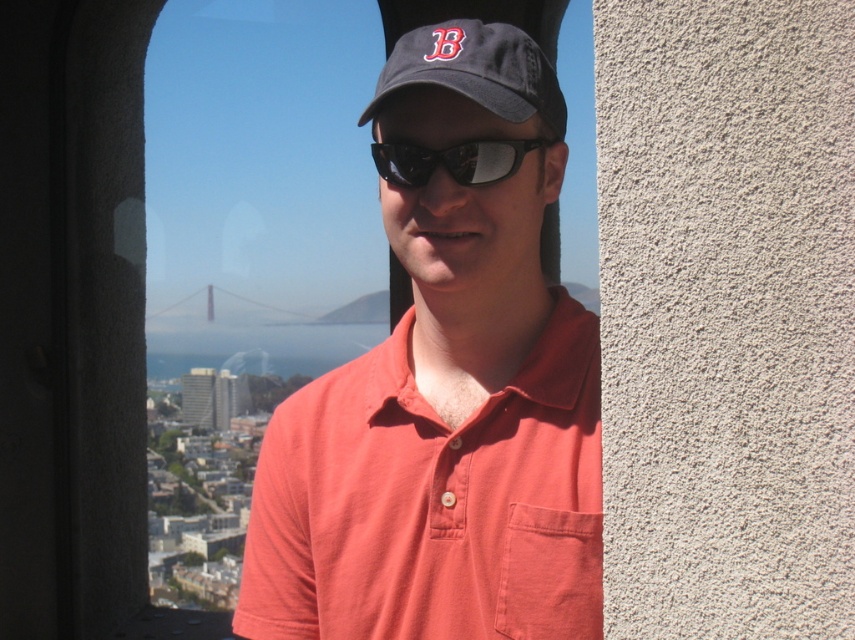
Describe the element at coordinates (445, 396) in the screenshot. I see `matte orange polo shirt at center` at that location.

Which is above, matte orange polo shirt at center or black reflective sunglasses at center?

black reflective sunglasses at center is higher up.

Measure the distance between matte orange polo shirt at center and camera.

The distance of matte orange polo shirt at center from camera is 147.84 meters.

I want to click on matte orange polo shirt at center, so click(445, 396).

Is dark gray fabric cap at center bigger than black reflective sunglasses at center?

Yes, dark gray fabric cap at center is bigger than black reflective sunglasses at center.

Is point (488, 72) closer to viewer compared to point (461, 177)?

Yes, point (488, 72) is in front of point (461, 177).

Find the location of a particular element. The height and width of the screenshot is (640, 855). dark gray fabric cap at center is located at coordinates (475, 70).

Can you confirm if matte orange polo shirt at center is positioned to the right of dark gray fabric cap at center?

Correct, you'll find matte orange polo shirt at center to the right of dark gray fabric cap at center.

Between matte orange polo shirt at center and dark gray fabric cap at center, which one appears on the right side from the viewer's perspective?

Positioned to the right is matte orange polo shirt at center.

What do you see at coordinates (445, 396) in the screenshot? The image size is (855, 640). I see `matte orange polo shirt at center` at bounding box center [445, 396].

Identify the location of matte orange polo shirt at center. This screenshot has height=640, width=855. (445, 396).